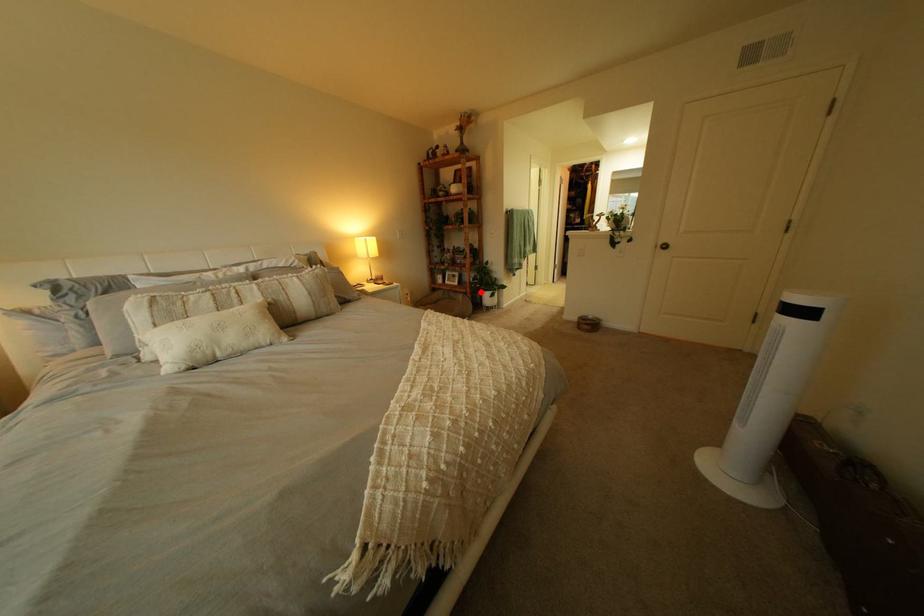
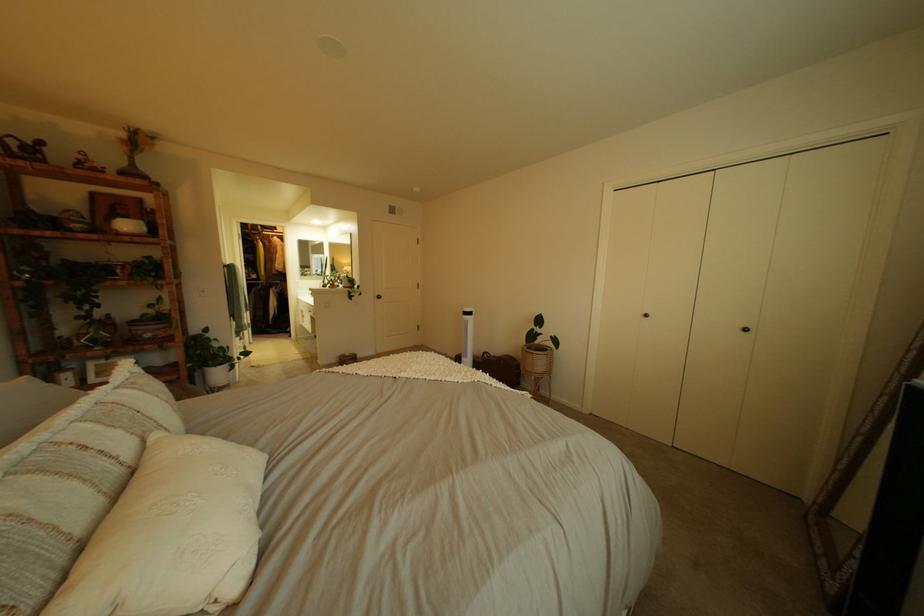
The point at the highlighted location is marked in the first image. Where is the corresponding point in the second image?

(189, 379)